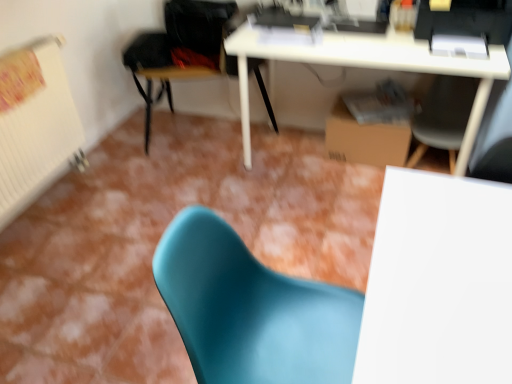
Where is `vacant space in front of black leather chair at center, placed as the 1th chair when sorted from back to front`? vacant space in front of black leather chair at center, placed as the 1th chair when sorted from back to front is located at coordinates (199, 196).